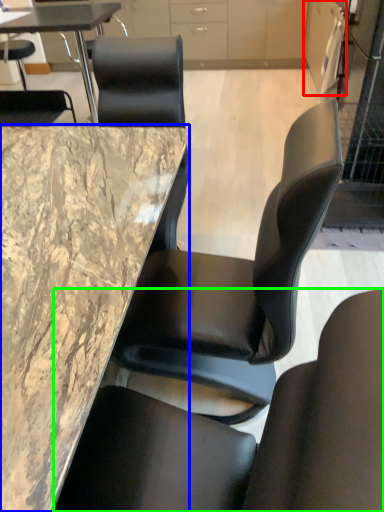
Question: Which object is the farthest from cabinetry (highlighted by a red box)? Choose among these: table (highlighted by a blue box) or chair (highlighted by a green box).

Choices:
 (A) table
 (B) chair

Answer: (B)